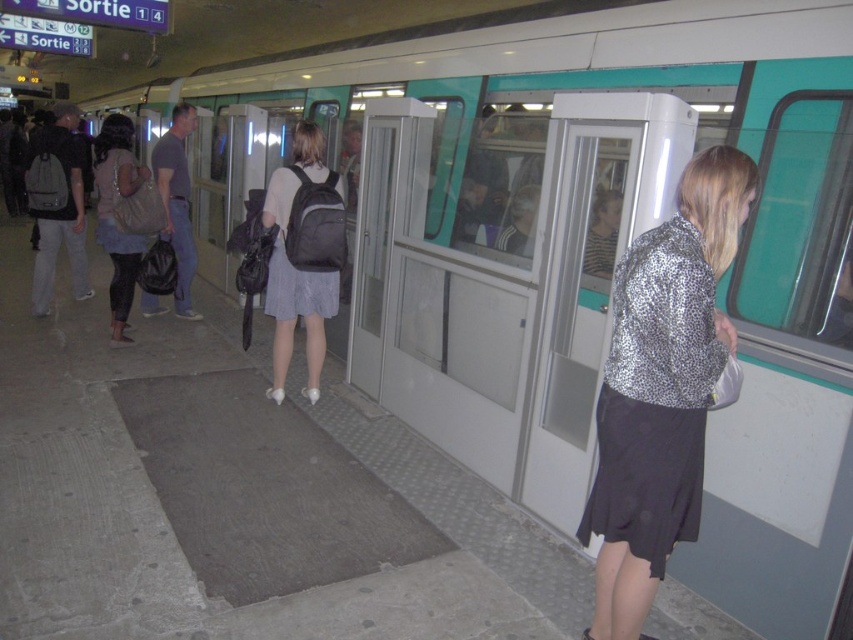
You are a passenger on the subway platform and need to retrieve your matte black backpack at center and matte black backpack at left. Which backpack is closer to you?

The matte black backpack at center is closer to you since it is only 5.43 feet away from the matte black backpack at left, but without knowing your exact position, it is difficult to determine which is closer. However, based on the given distance between them, the backpack at center is nearer to the one at left.

Looking at this image, you are a passenger waiting on the subway platform. You see a matte black backpack at left and a dark gray backpack at center. Which backpack is closer to you?

The matte black backpack at left is closer to you because it is in front of the dark gray backpack at center.

You are standing at the entrance of the subway station and want to reach the point marked as point (115,282). If your walking speed is 3 feet per second, how many seconds will it take you to reach that point?

The distance of point (115,282) from camera is 18.27 feet. At a speed of 3 feet per second, it will take you 18.27 divided by 3, which is approximately 6.09 seconds to reach the point.